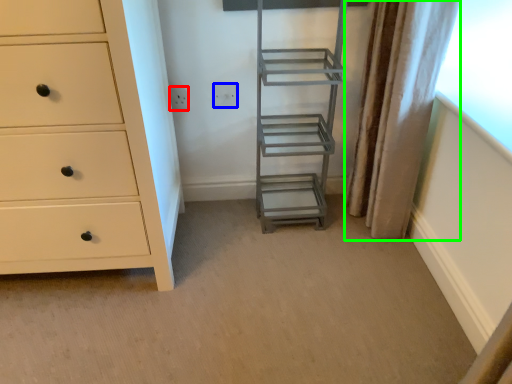
Question: Which object is the closest to the electric outlet (highlighted by a red box)? Choose among these: electric outlet (highlighted by a blue box) or curtain (highlighted by a green box).

Choices:
 (A) electric outlet
 (B) curtain

Answer: (A)